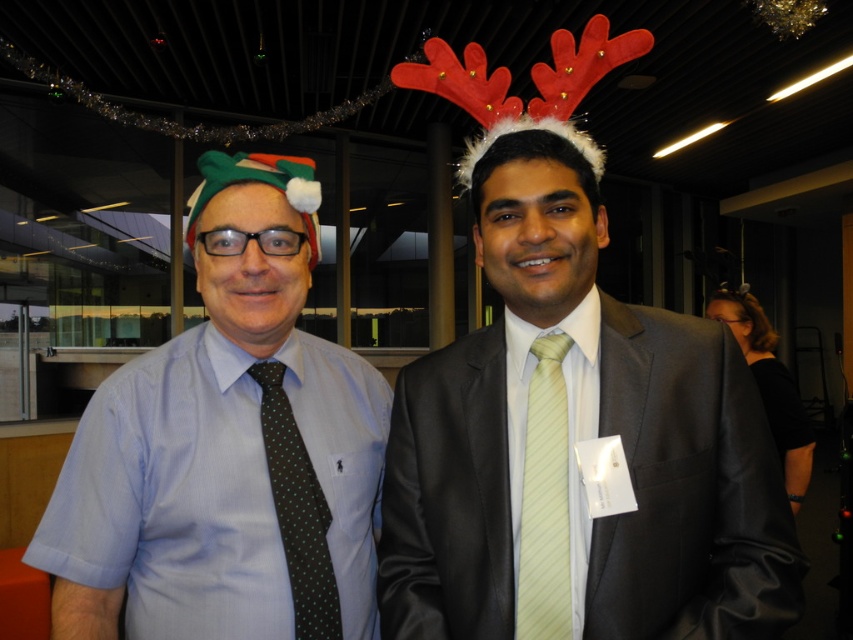
You are a photographer at a party and need to adjust your camera focus. You see the matte black suit at center and the dark green dotted tie at left. Which one is closer to the camera?

The matte black suit at center is closer to the camera because it is positioned over the dark green dotted tie at left, indicating it is in front of it.